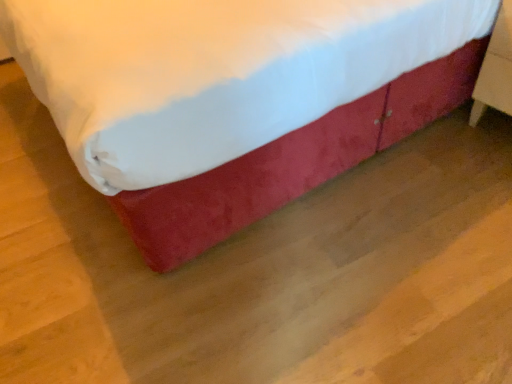
Question: Should I look upward or downward to see velvet red bed at center?

Choices:
 (A) up
 (B) down

Answer: (A)

Question: From a real-world perspective, does wooden nightstand at right sit lower than velvet red bed at center?

Choices:
 (A) yes
 (B) no

Answer: (A)

Question: Is wooden nightstand at right turned away from velvet red bed at center?

Choices:
 (A) yes
 (B) no

Answer: (A)

Question: Does wooden nightstand at right have a greater height compared to velvet red bed at center?

Choices:
 (A) yes
 (B) no

Answer: (B)

Question: From a real-world perspective, is wooden nightstand at right on top of velvet red bed at center?

Choices:
 (A) yes
 (B) no

Answer: (B)

Question: Does wooden nightstand at right lie in front of velvet red bed at center?

Choices:
 (A) no
 (B) yes

Answer: (A)

Question: Considering the relative sizes of wooden nightstand at right and velvet red bed at center in the image provided, is wooden nightstand at right bigger than velvet red bed at center?

Choices:
 (A) no
 (B) yes

Answer: (A)

Question: Considering the relative sizes of velvet red bed at center and wooden nightstand at right in the image provided, is velvet red bed at center shorter than wooden nightstand at right?

Choices:
 (A) no
 (B) yes

Answer: (A)

Question: From the image's perspective, is velvet red bed at center beneath wooden nightstand at right?

Choices:
 (A) yes
 (B) no

Answer: (B)

Question: Is velvet red bed at center in front of wooden nightstand at right?

Choices:
 (A) yes
 (B) no

Answer: (A)

Question: Is wooden nightstand at right completely or partially inside velvet red bed at center?

Choices:
 (A) no
 (B) yes

Answer: (B)

Question: Is velvet red bed at center in contact with wooden nightstand at right?

Choices:
 (A) yes
 (B) no

Answer: (B)

Question: From a real-world perspective, is velvet red bed at center physically above wooden nightstand at right?

Choices:
 (A) yes
 (B) no

Answer: (A)

Question: Is wooden nightstand at right in front of or behind velvet red bed at center in the image?

Choices:
 (A) behind
 (B) front

Answer: (A)